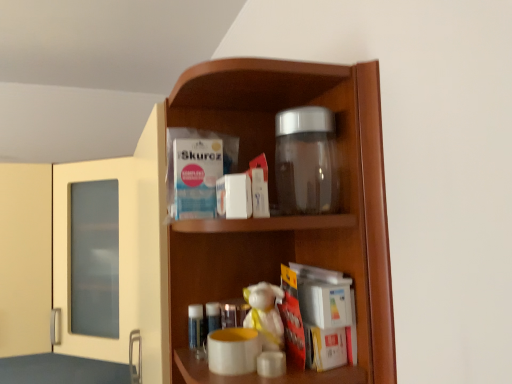
The height and width of the screenshot is (384, 512). In order to click on white plush toy at center in this screenshot , I will do `click(265, 314)`.

Considering the relative sizes of transparent glass jar at upper center and transparent glass jar at upper center in the image provided, is transparent glass jar at upper center wider than transparent glass jar at upper center?

Correct, the width of transparent glass jar at upper center exceeds that of transparent glass jar at upper center.

In the image, is transparent glass jar at upper center positioned in front of or behind transparent glass jar at upper center?

transparent glass jar at upper center is positioned farther from the viewer than transparent glass jar at upper center.

From the image's perspective, is transparent glass jar at upper center over transparent glass jar at upper center?

Actually, transparent glass jar at upper center appears below transparent glass jar at upper center in the image.

Can you confirm if transparent glass jar at upper center is smaller than white plush toy at center?

Actually, transparent glass jar at upper center might be larger than white plush toy at center.

Find the location of a particular element. This screenshot has width=512, height=384. cupboard on the left of white plush toy at center is located at coordinates (206, 226).

Do you think transparent glass jar at upper center is within white plush toy at center, or outside of it?

transparent glass jar at upper center is not enclosed by white plush toy at center.

Which object is positioned more to the left, transparent glass jar at upper center or white plush toy at center?

Positioned to the left is transparent glass jar at upper center.

From a real-world perspective, is transparent glass jar at upper center over transparent glass jar at upper center?

Indeed, from a real-world perspective, transparent glass jar at upper center stands above transparent glass jar at upper center.

Between transparent glass jar at upper center and transparent glass jar at upper center, which one has larger size?

With larger size is transparent glass jar at upper center.

You are a GUI agent. You are given a task and a screenshot of the screen. Output one action in this format:
    pyautogui.click(x=<x>, y=<y>)
    Task: Click on the glass jar that is in front of the transparent glass jar at upper center
    This screenshot has width=512, height=384.
    Given the screenshot: What is the action you would take?
    pyautogui.click(x=306, y=161)

Is transparent glass jar at upper center completely or partially inside transparent glass jar at upper center?

No, transparent glass jar at upper center is located outside of transparent glass jar at upper center.

Between white plush toy at center and transparent glass jar at upper center, which one has smaller size?

Smaller between the two is white plush toy at center.

From the picture: From a real-world perspective, which object rests below the other?

white plush toy at center is physically lower.

How distant is white plush toy at center from transparent glass jar at upper center?

white plush toy at center and transparent glass jar at upper center are 8.84 inches apart.

Is white plush toy at center next to transparent glass jar at upper center and touching it?

No, white plush toy at center is not touching transparent glass jar at upper center.

Is transparent glass jar at upper center further to camera compared to white plush toy at center?

No, it is not.

Does point (315, 188) appear closer or farther from the camera than point (268, 347)?

Point (315, 188).

From the image's perspective, is transparent glass jar at upper center located beneath white plush toy at center?

No, from the image's perspective, transparent glass jar at upper center is not beneath white plush toy at center.

Locate an element on the screen. The image size is (512, 384). glass jar above the white plush toy at center (from the image's perspective) is located at coordinates (306, 161).

Considering the points (273, 292) and (110, 159), which point is in front, point (273, 292) or point (110, 159)?

The point (273, 292) is more forward.

Which object is closer to the camera taking this photo, white plush toy at center or transparent glass jar at upper center?

transparent glass jar at upper center is more forward.

Does white plush toy at center touch transparent glass jar at upper center?

No, white plush toy at center is not with transparent glass jar at upper center.

Locate an element on the screen. glass jar in front of the transparent glass jar at upper center is located at coordinates (306, 161).

Image resolution: width=512 pixels, height=384 pixels. Find the location of `toy that is above the transparent glass jar at upper center (from the image's perspective)`. toy that is above the transparent glass jar at upper center (from the image's perspective) is located at coordinates click(265, 314).

From the image, which object appears to be nearer to transparent glass jar at upper center, transparent glass jar at upper center or white plush toy at center?

Among the two, transparent glass jar at upper center is located nearer to transparent glass jar at upper center.

Looking at this image, which object lies nearer to the anchor point transparent glass jar at upper center, white plush toy at center or transparent glass jar at upper center?

Among the two, transparent glass jar at upper center is located nearer to transparent glass jar at upper center.

Estimate the real-world distances between objects in this image. Which object is closer to transparent glass jar at upper center, transparent glass jar at upper center or white plush toy at center?

transparent glass jar at upper center.

Estimate the real-world distances between objects in this image. Which object is closer to white plush toy at center, transparent glass jar at upper center or transparent glass jar at upper center?

The object closer to white plush toy at center is transparent glass jar at upper center.

Looking at the image, which one is located closer to white plush toy at center, transparent glass jar at upper center or transparent glass jar at upper center?

transparent glass jar at upper center is positioned closer to the anchor white plush toy at center.

Based on the photo, from the image, which object appears to be nearer to transparent glass jar at upper center, white plush toy at center or transparent glass jar at upper center?

transparent glass jar at upper center.

At what (x,y) coordinates should I click in order to perform the action: click on toy situated between transparent glass jar at upper center and transparent glass jar at upper center from left to right. Please return your answer as a coordinate pair (x, y). The image size is (512, 384). Looking at the image, I should click on (265, 314).